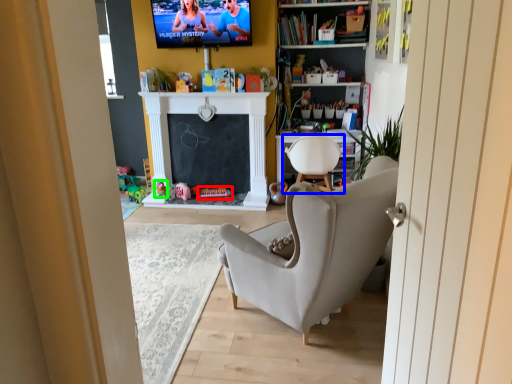
Question: Estimate the real-world distances between objects in this image. Which object is farther from toy (highlighted by a red box), chair (highlighted by a blue box) or toy (highlighted by a green box)?

Choices:
 (A) chair
 (B) toy

Answer: (A)